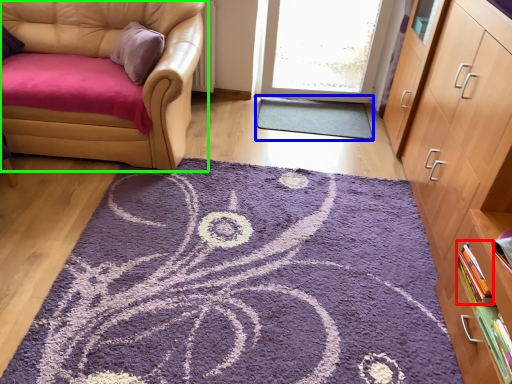
Question: Considering the real-world distances, which object is farthest from book (highlighted by a red box)? doormat (highlighted by a blue box) or chair (highlighted by a green box)?

Choices:
 (A) doormat
 (B) chair

Answer: (B)